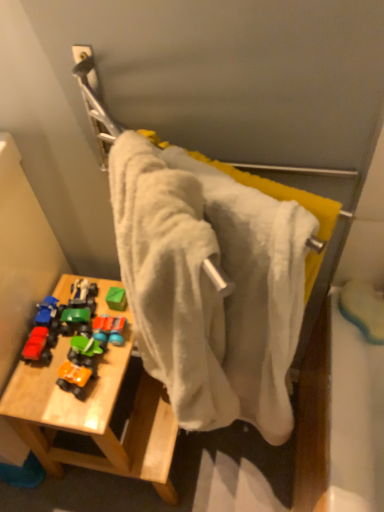
The height and width of the screenshot is (512, 384). In order to click on free space above wooden table at lower left (from a real-world perspective) in this screenshot , I will do `click(72, 374)`.